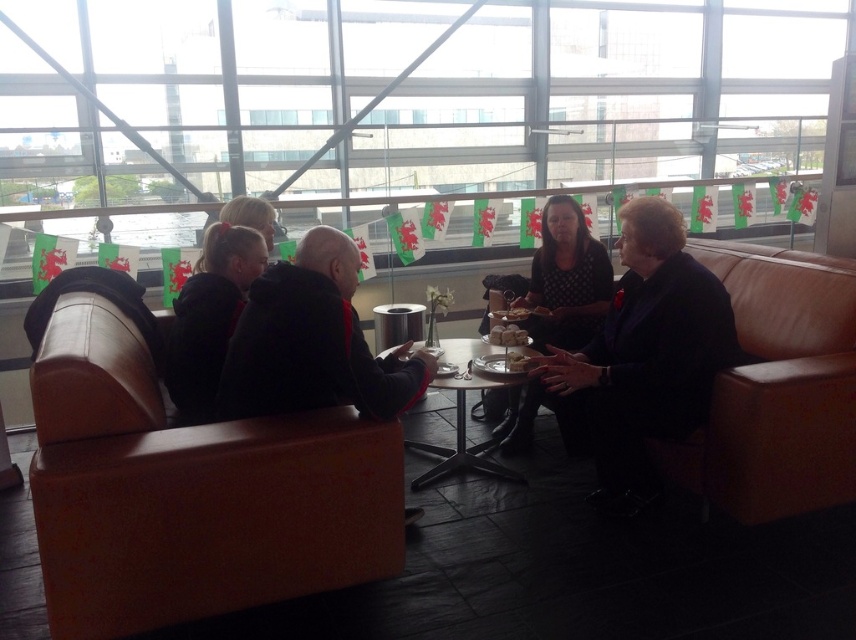
Between point (333, 356) and point (586, 285), which one is positioned in front?

Point (333, 356) is in front.

Does black leather jacket at center have a smaller size compared to polka dot dress at center?

Indeed, black leather jacket at center has a smaller size compared to polka dot dress at center.

Identify the location of black leather jacket at center. (313, 342).

Which of these two, dark brown leather jacket at center or polka dot dress at center, stands taller?

Standing taller between the two is polka dot dress at center.

The width and height of the screenshot is (856, 640). What do you see at coordinates (642, 358) in the screenshot?
I see `dark brown leather jacket at center` at bounding box center [642, 358].

Where is `dark brown leather jacket at center`? The width and height of the screenshot is (856, 640). dark brown leather jacket at center is located at coordinates (642, 358).

Does brown leather couch at left lie in front of dark brown leather jacket at center?

Yes, brown leather couch at left is in front of dark brown leather jacket at center.

The image size is (856, 640). Identify the location of brown leather couch at left. (191, 492).